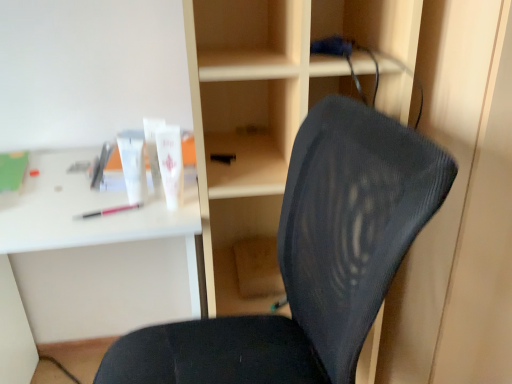
The image size is (512, 384). I want to click on vacant space in front of white glossy tube at upper center, positioned as the second toiletry in left-to-right order, so click(142, 217).